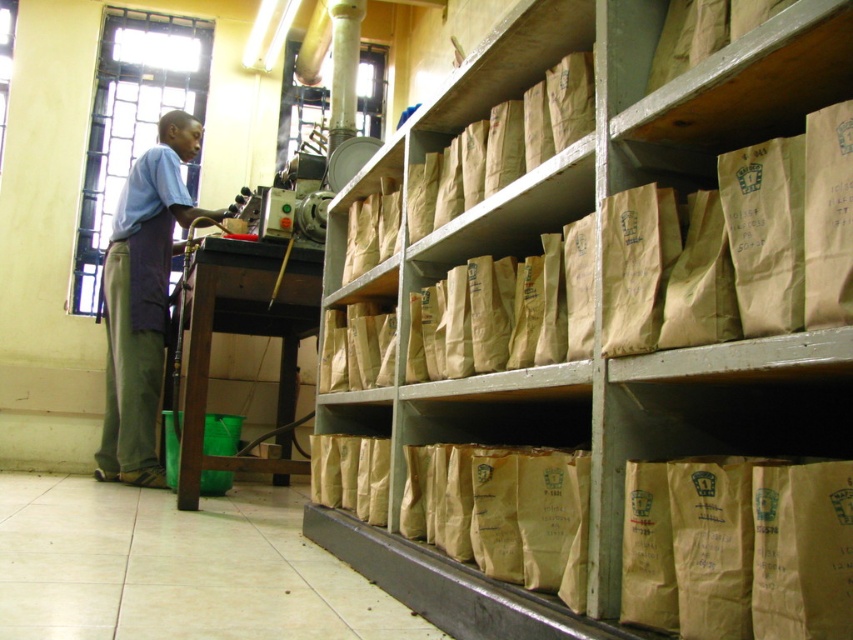
Which is more to the right, brown paper bags at right or blue fabric apron at left?

brown paper bags at right

Is point (410, 282) positioned after point (183, 154)?

No.

At what (x,y) coordinates should I click in order to perform the action: click on brown paper bags at right. Please return your answer as a coordinate pair (x, y). Looking at the image, I should click on (622, 417).